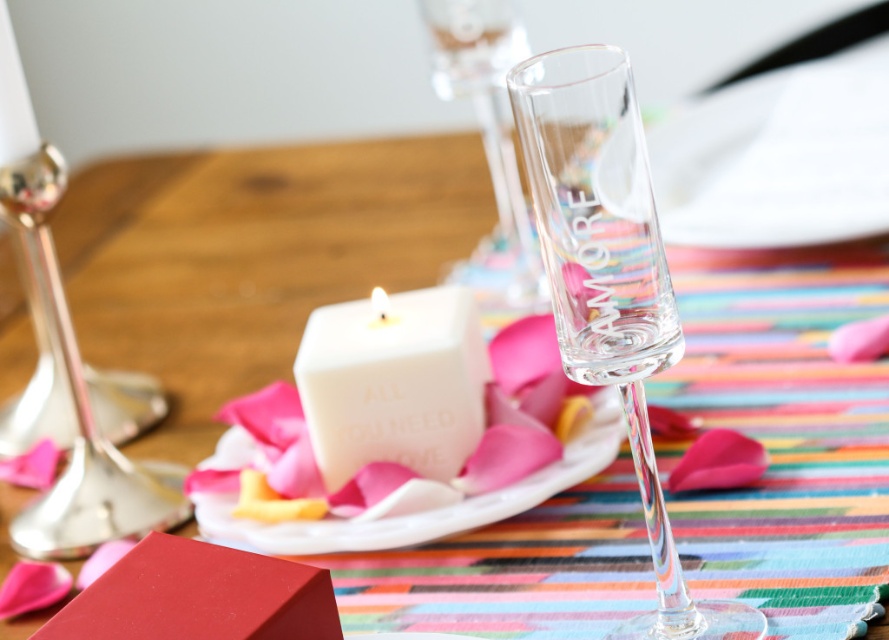
Question: Is transparent glass flute at center smaller than white matte plate at center?

Choices:
 (A) no
 (B) yes

Answer: (B)

Question: Which of the following is the closest to the observer?

Choices:
 (A) (521, 326)
 (B) (469, 316)
 (C) (639, 400)

Answer: (C)

Question: Can you confirm if transparent glass flute at center is positioned to the right of white matte cube at center?

Choices:
 (A) yes
 (B) no

Answer: (A)

Question: Which point is closer to the camera taking this photo?

Choices:
 (A) (195, 497)
 (B) (647, 442)
 (C) (434, 465)

Answer: (B)

Question: Can you confirm if transparent glass flute at center is positioned below white matte cube at center?

Choices:
 (A) no
 (B) yes

Answer: (A)

Question: Considering the real-world distances, which object is closest to the transparent glass flute at center?

Choices:
 (A) white matte plate at center
 (B) white matte cube at center

Answer: (B)